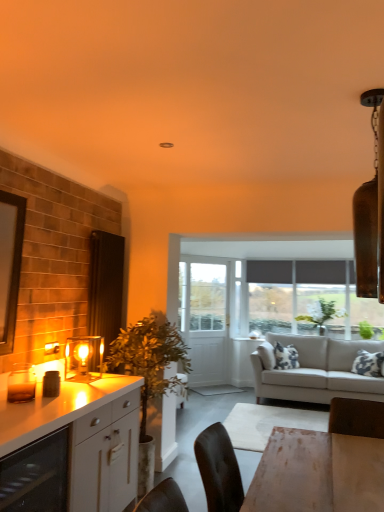
Locate an element on the screen. vacant area situated below matte glass lampshade at left (from a real-world perspective) is located at coordinates (89, 377).